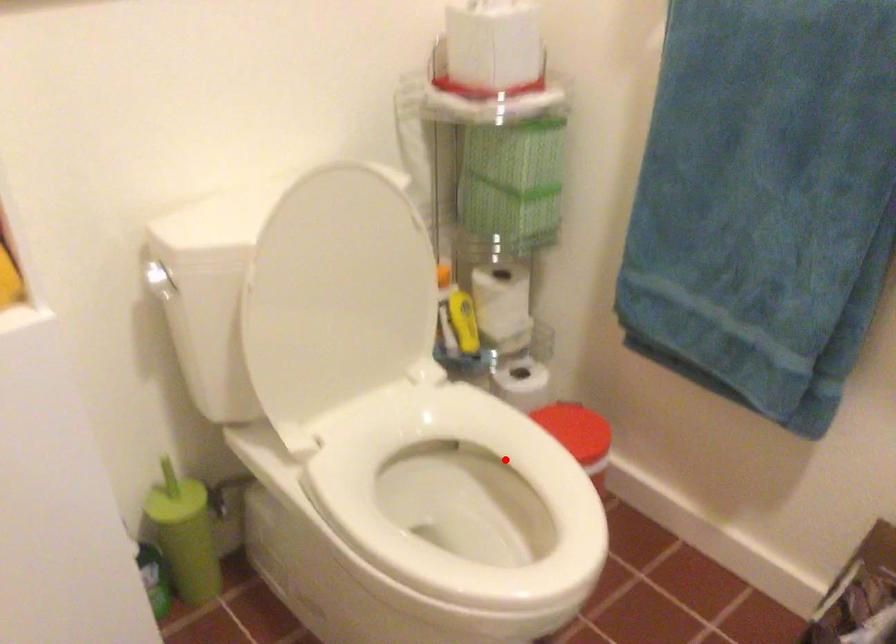
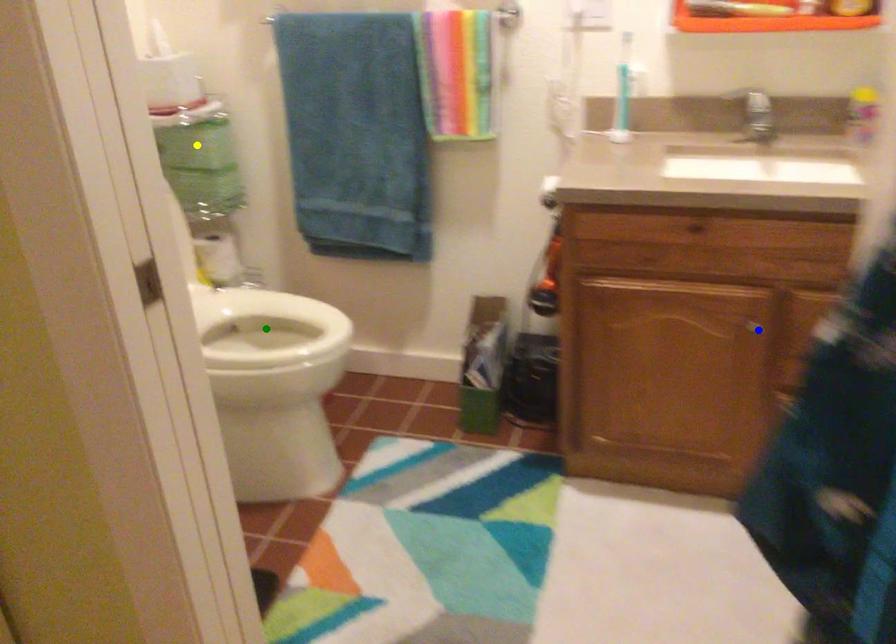
Question: I am providing you with two images of the same scene from different viewpoints. A red point is marked on the first image. You are given multiple points on the second image. Can you choose the point in image 2 that corresponds to the point in image 1?

Choices:
 (A) blue point
 (B) green point
 (C) yellow point

Answer: (B)